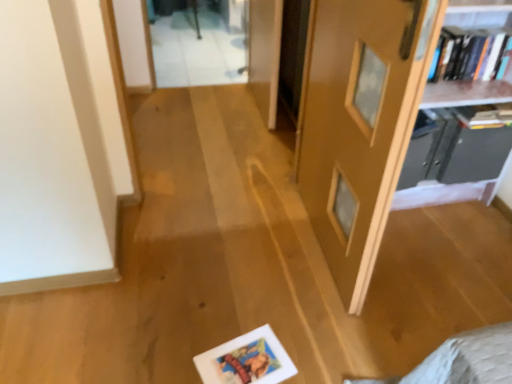
Question: Looking at the image, does black plastic shelf at upper right, which ranks as the second shelf in top-to-bottom order, seem bigger or smaller compared to white matte picture frame at lower center?

Choices:
 (A) small
 (B) big

Answer: (B)

Question: In the image, is black plastic shelf at upper right, which ranks as the second shelf in top-to-bottom order, positioned in front of or behind white matte picture frame at lower center?

Choices:
 (A) behind
 (B) front

Answer: (A)

Question: Which is nearer to the hardcover book at upper right, the first book from the bottom?

Choices:
 (A) black plastic shelf at upper right, which ranks as the second shelf in top-to-bottom order
 (B) wooden bookshelf at upper right, which appears as the 2th shelf when ordered from the bottom
 (C) transparent glass door at upper center
 (D) white matte picture frame at lower center
 (E) matte wooden door at center

Answer: (A)

Question: Which of these objects is positioned farthest from the hardcover book at upper right, the first book from the bottom?

Choices:
 (A) matte wooden door at center
 (B) wooden bookshelf at upper right, which appears as the 2th shelf when ordered from the bottom
 (C) black plastic shelf at upper right, marked as the 1th shelf in a bottom-to-top arrangement
 (D) hardcover books at upper right, which ranks as the 1th book in top-to-bottom order
 (E) transparent glass door at upper center

Answer: (E)